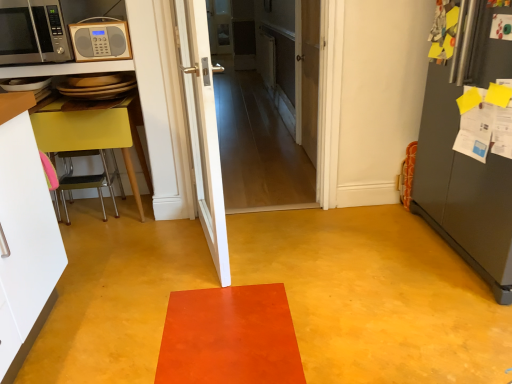
This screenshot has height=384, width=512. Find the location of `free space in front of white glossy door at center, which appears as the first door when viewed from the front`. free space in front of white glossy door at center, which appears as the first door when viewed from the front is located at coordinates (200, 297).